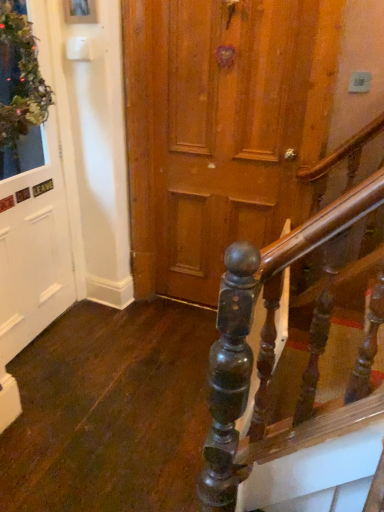
Question: Does white matte door at left come in front of green mossy wreath at upper left?

Choices:
 (A) yes
 (B) no

Answer: (B)

Question: Considering the relative sizes of white matte door at left and green mossy wreath at upper left in the image provided, is white matte door at left shorter than green mossy wreath at upper left?

Choices:
 (A) yes
 (B) no

Answer: (B)

Question: Is white matte door at left with green mossy wreath at upper left?

Choices:
 (A) no
 (B) yes

Answer: (A)

Question: Can we say white matte door at left lies outside green mossy wreath at upper left?

Choices:
 (A) yes
 (B) no

Answer: (A)

Question: Is white matte door at left aimed at green mossy wreath at upper left?

Choices:
 (A) yes
 (B) no

Answer: (A)

Question: Is white matte door at left to the left of green mossy wreath at upper left from the viewer's perspective?

Choices:
 (A) yes
 (B) no

Answer: (A)

Question: From the image's perspective, would you say green mossy wreath at upper left is shown under white matte door at left?

Choices:
 (A) yes
 (B) no

Answer: (B)

Question: Is green mossy wreath at upper left touching white matte door at left?

Choices:
 (A) no
 (B) yes

Answer: (A)

Question: Can you confirm if green mossy wreath at upper left is thinner than white matte door at left?

Choices:
 (A) yes
 (B) no

Answer: (B)

Question: Considering the relative positions of green mossy wreath at upper left and white matte door at left in the image provided, is green mossy wreath at upper left to the left of white matte door at left from the viewer's perspective?

Choices:
 (A) yes
 (B) no

Answer: (B)

Question: Is green mossy wreath at upper left completely or partially outside of white matte door at left?

Choices:
 (A) yes
 (B) no

Answer: (A)

Question: Is green mossy wreath at upper left at the right side of white matte door at left?

Choices:
 (A) yes
 (B) no

Answer: (A)

Question: Would you say green mossy wreath at upper left is to the left or to the right of white matte door at left in the picture?

Choices:
 (A) left
 (B) right

Answer: (B)